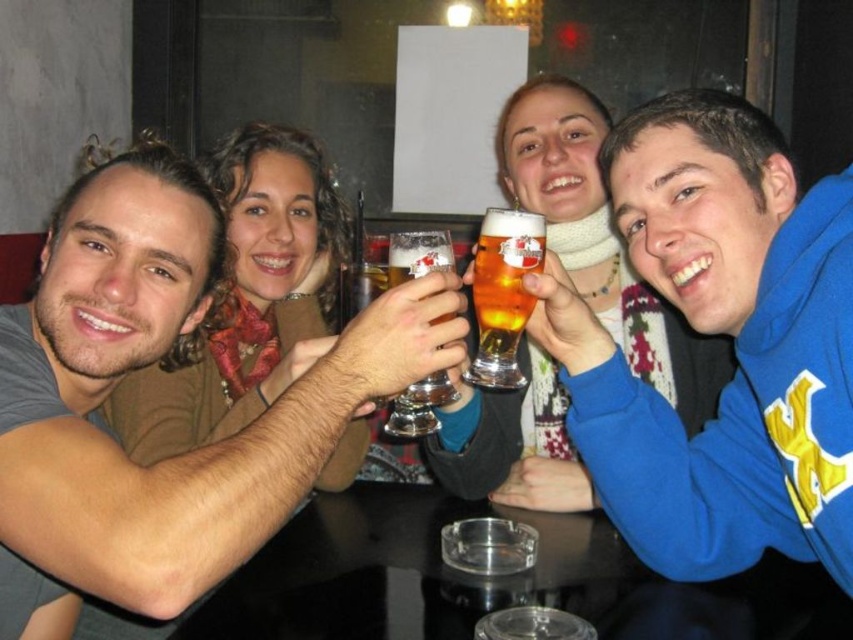
Question: Is translucent glass mug at center further to the viewer compared to translucent glass beer glass at center?

Choices:
 (A) yes
 (B) no

Answer: (A)

Question: Which object appears farthest from the camera in this image?

Choices:
 (A) translucent glass mug at center
 (B) matte gray shirt at left
 (C) blue fleece sweatshirt at upper right
 (D) transparent glass ashtray at center

Answer: (A)

Question: Is matte gray shirt at left smaller than translucent glass beer glass at center?

Choices:
 (A) yes
 (B) no

Answer: (B)

Question: Is transparent glass ashtray at center to the right of translucent glass beer glass at center from the viewer's perspective?

Choices:
 (A) no
 (B) yes

Answer: (A)

Question: Which of the following is the closest to the observer?

Choices:
 (A) translucent glass beer glass at center
 (B) matte gray shirt at left
 (C) transparent glass ashtray at center
 (D) blue fleece sweatshirt at upper right

Answer: (B)

Question: Which point appears farthest from the camera in this image?

Choices:
 (A) (515, 227)
 (B) (436, 572)

Answer: (B)